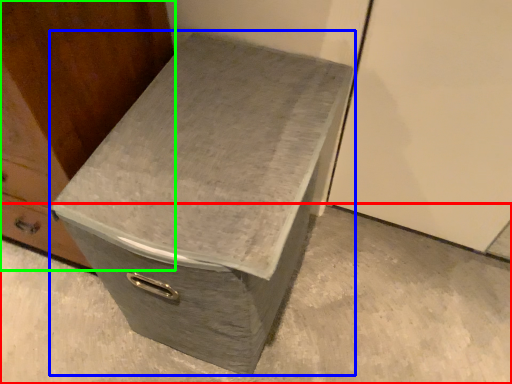
Question: Considering the real-world distances, which object is farthest from concrete (highlighted by a red box)? shoe box (highlighted by a blue box) or furniture (highlighted by a green box)?

Choices:
 (A) shoe box
 (B) furniture

Answer: (B)